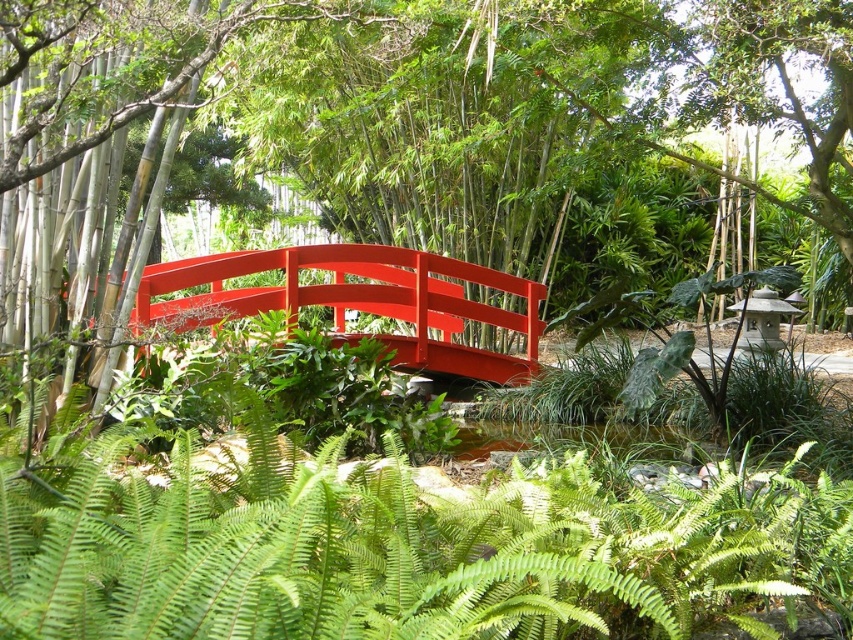
Consider the image. Does green leafy tree at center lie in front of glossy wood bridge at center?

That is True.

How much distance is there between green leafy tree at center and glossy wood bridge at center?

2.26 meters

Locate an element on the screen. green leafy tree at center is located at coordinates pos(416,156).

Where is `green leafy tree at center`? The width and height of the screenshot is (853, 640). green leafy tree at center is located at coordinates (416, 156).